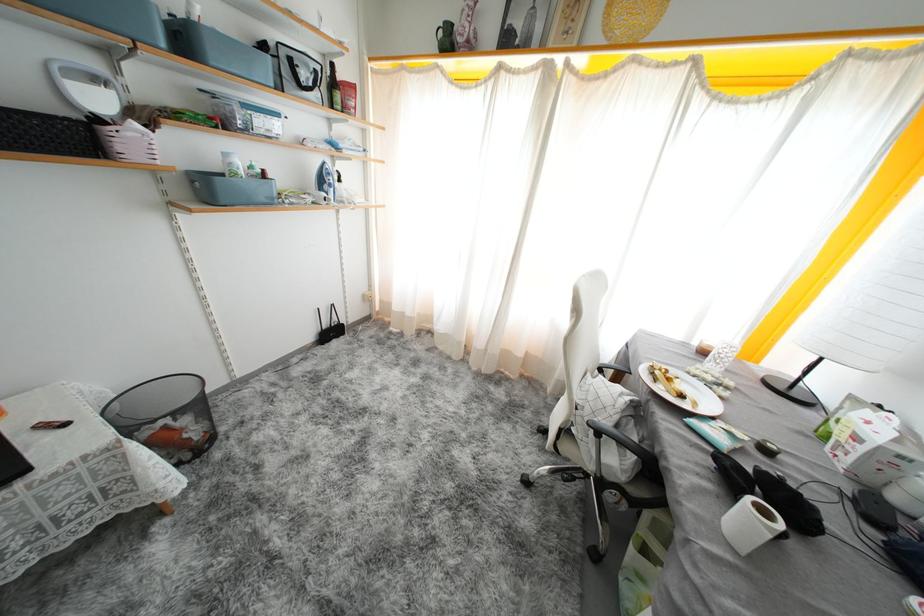
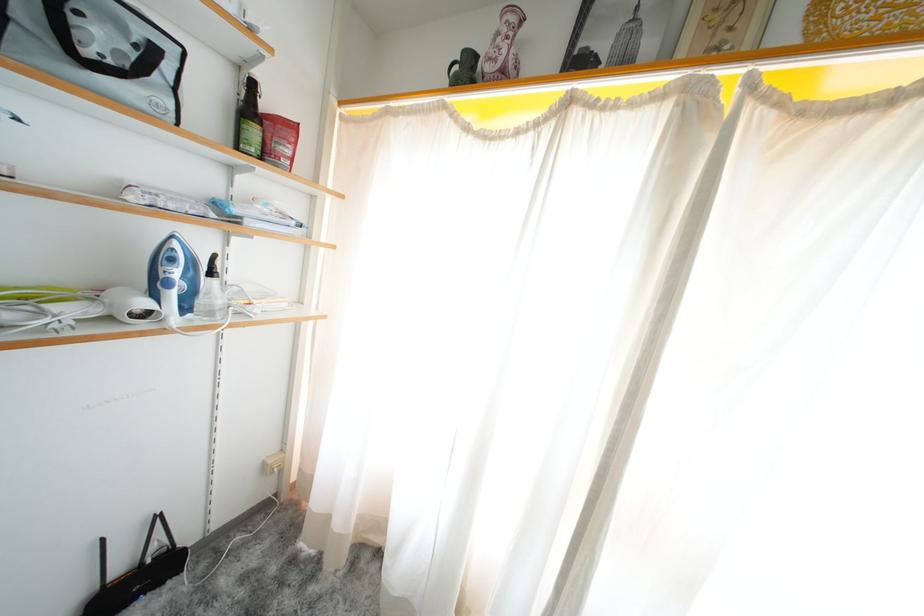
The point at (x=387, y=305) is marked in the first image. Where is the corresponding point in the second image?

(306, 475)